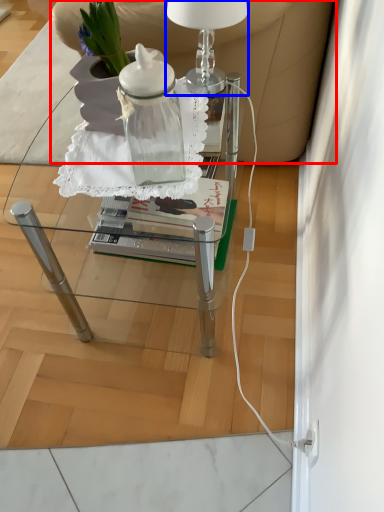
Question: Among these objects, which one is nearest to the camera, armchair (highlighted by a red box) or table lamp (highlighted by a blue box)?

Choices:
 (A) armchair
 (B) table lamp

Answer: (B)